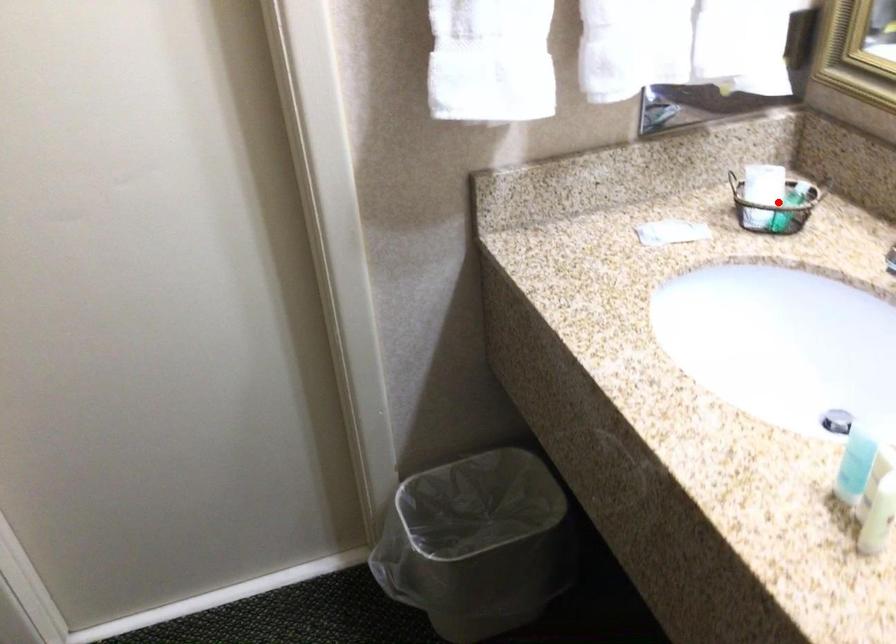
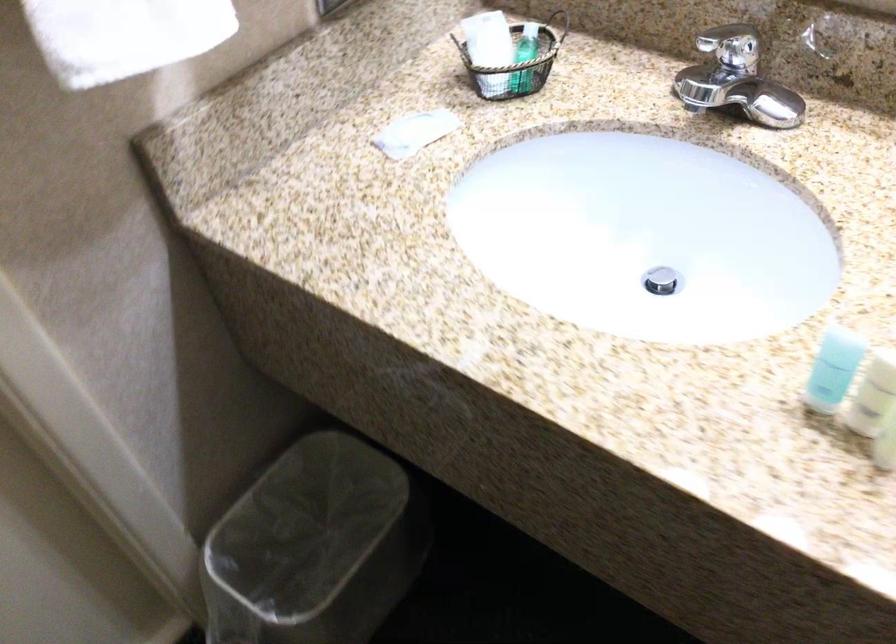
The point at the highlighted location is marked in the first image. Where is the corresponding point in the second image?

(524, 59)